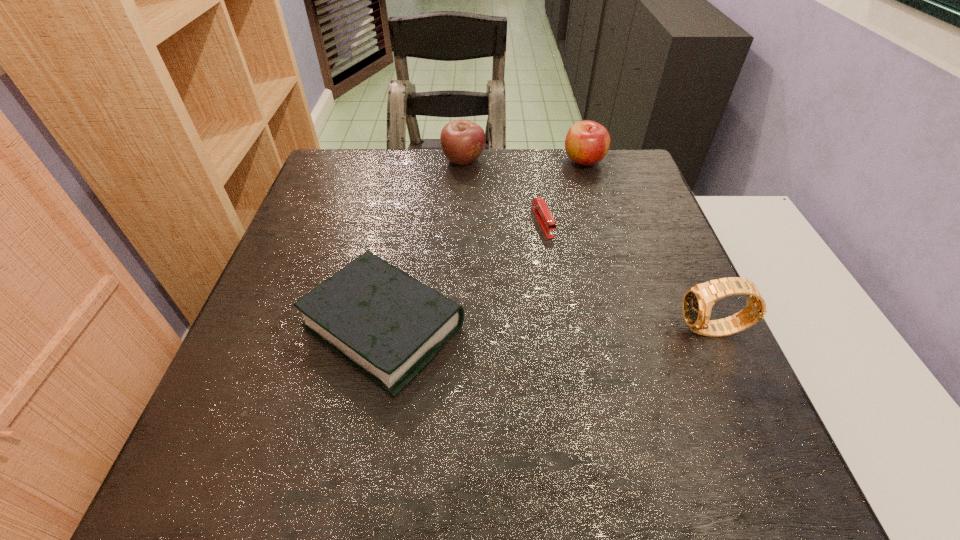
The height and width of the screenshot is (540, 960). Identify the location of object located in the left edge section of the desktop. pos(390,326).

The width and height of the screenshot is (960, 540). What are the coordinates of `watch that is positioned at the right edge` in the screenshot? It's located at coord(698,300).

Locate an element on the screen. apple located at the right edge is located at coordinates (587, 142).

Identify the location of object situated at the near left corner. (390, 326).

At what (x,y) coordinates should I click in order to perform the action: click on object positioned at the far right corner. Please return your answer as a coordinate pair (x, y). Looking at the image, I should click on (587, 142).

Find the location of a particular element. The image size is (960, 540). vacant point at the far edge is located at coordinates (550, 185).

The height and width of the screenshot is (540, 960). What are the coordinates of `vacant space at the left edge` in the screenshot? It's located at (337, 267).

This screenshot has width=960, height=540. In order to click on free space at the right edge in this screenshot , I will do `click(660, 381)`.

Find the location of a particular element. Image resolution: width=960 pixels, height=540 pixels. free spot at the far left corner of the desktop is located at coordinates (381, 158).

Image resolution: width=960 pixels, height=540 pixels. Identify the location of free region at the far right corner of the desktop. (597, 169).